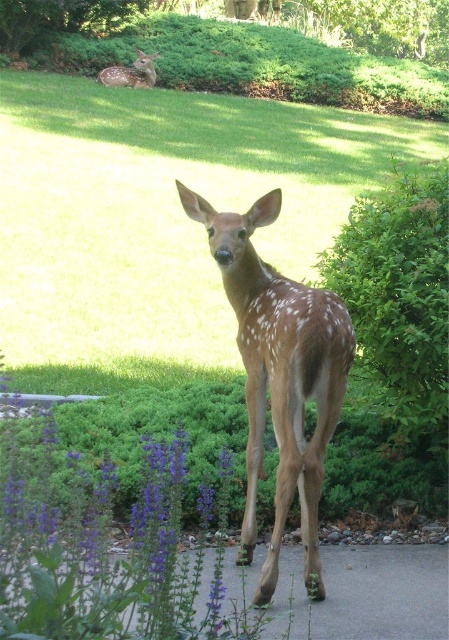
Can you confirm if brown speckled fur at center is wider than gray asphalt pavement at lower center?

No.

Can you confirm if brown speckled fur at center is shorter than gray asphalt pavement at lower center?

Incorrect, brown speckled fur at center's height does not fall short of gray asphalt pavement at lower center's.

Which is in front, point (308, 593) or point (348, 548)?

Point (308, 593) is more forward.

Locate an element on the screen. The width and height of the screenshot is (449, 640). brown speckled fur at center is located at coordinates (280, 374).

Who is positioned more to the right, gray asphalt pavement at lower center or spotted fur deer at upper left?

gray asphalt pavement at lower center

Image resolution: width=449 pixels, height=640 pixels. Describe the element at coordinates (366, 593) in the screenshot. I see `gray asphalt pavement at lower center` at that location.

Does point (432, 560) come closer to viewer compared to point (118, 72)?

Yes, it is in front of point (118, 72).

Image resolution: width=449 pixels, height=640 pixels. Find the location of `gray asphalt pavement at lower center`. gray asphalt pavement at lower center is located at coordinates (366, 593).

Is brown speckled fur at center further to the viewer compared to spotted fur deer at upper left?

No, it is not.

Is point (342, 376) behind point (128, 74)?

No, it is not.

Which is behind, point (303, 448) or point (123, 67)?

The point (123, 67) is more distant.

This screenshot has width=449, height=640. I want to click on brown speckled fur at center, so click(x=280, y=374).